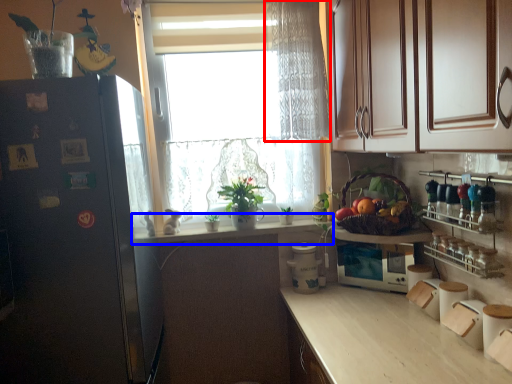
Question: Which of the following is the closest to the observer, curtain (highlighted by a red box) or countertop (highlighted by a blue box)?

Choices:
 (A) curtain
 (B) countertop

Answer: (A)